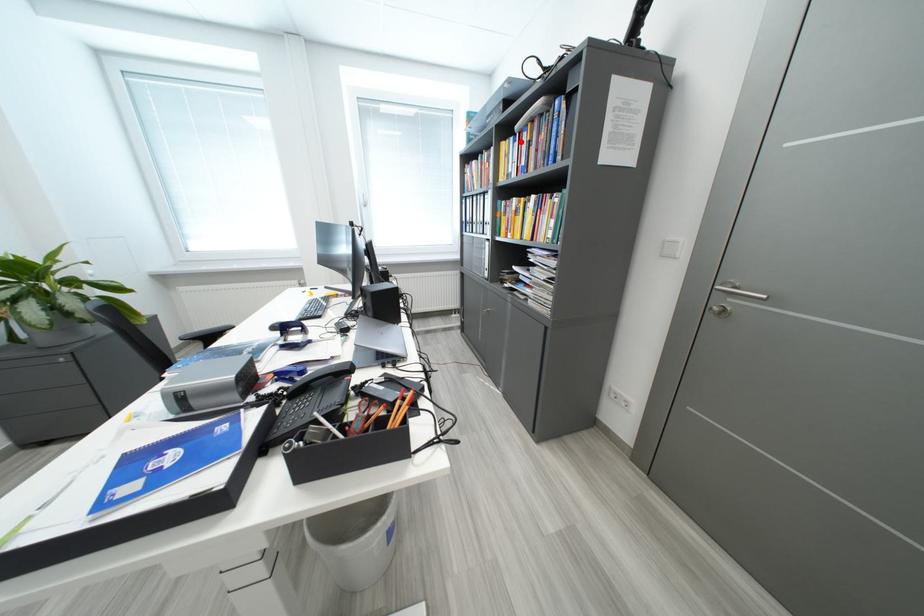
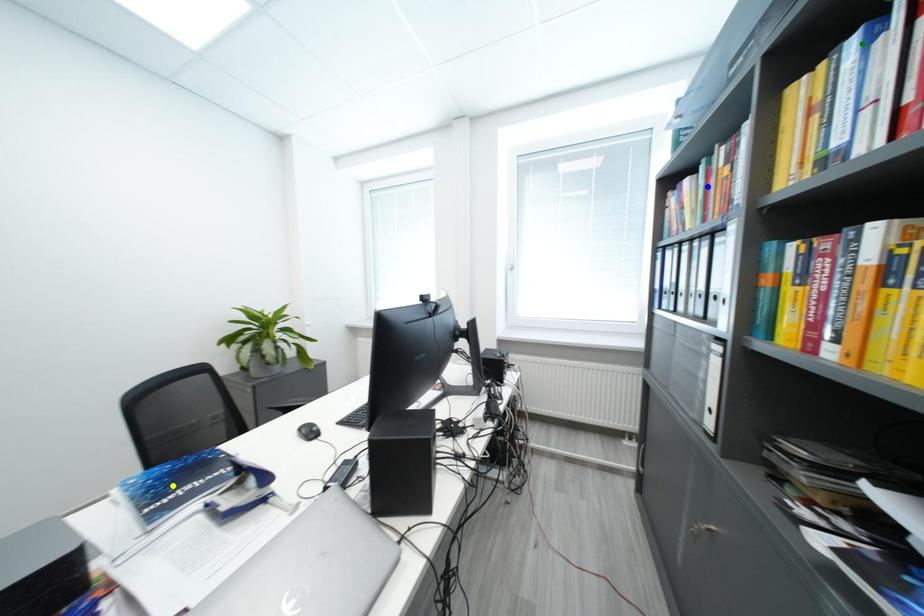
Question: I am providing you with two images of the same scene from different viewpoints. A red point is marked on the first image. You are given multiple points on the second image. Which point in image 2 represents the same 3d spot as the red point in image 1?

Choices:
 (A) blue point
 (B) green point
 (C) yellow point

Answer: (B)